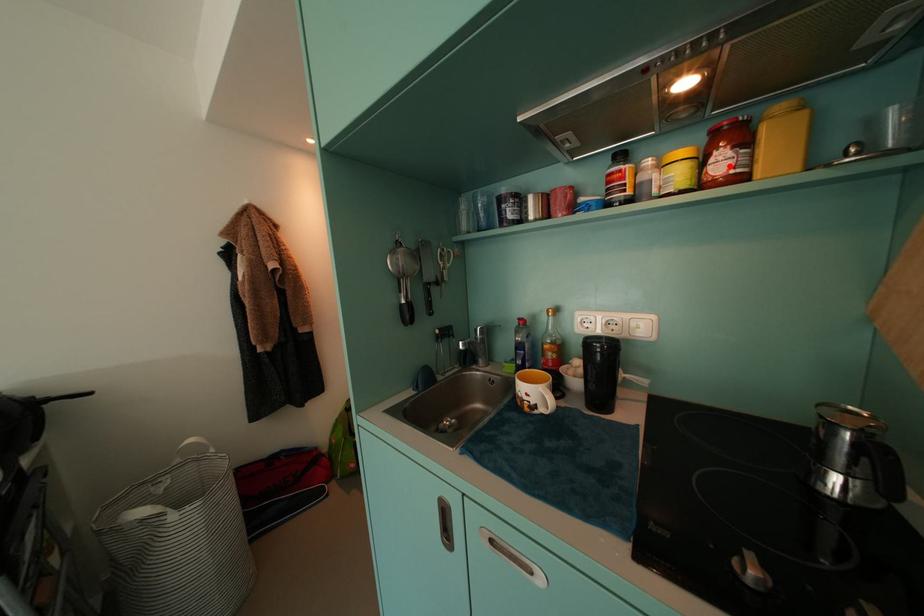
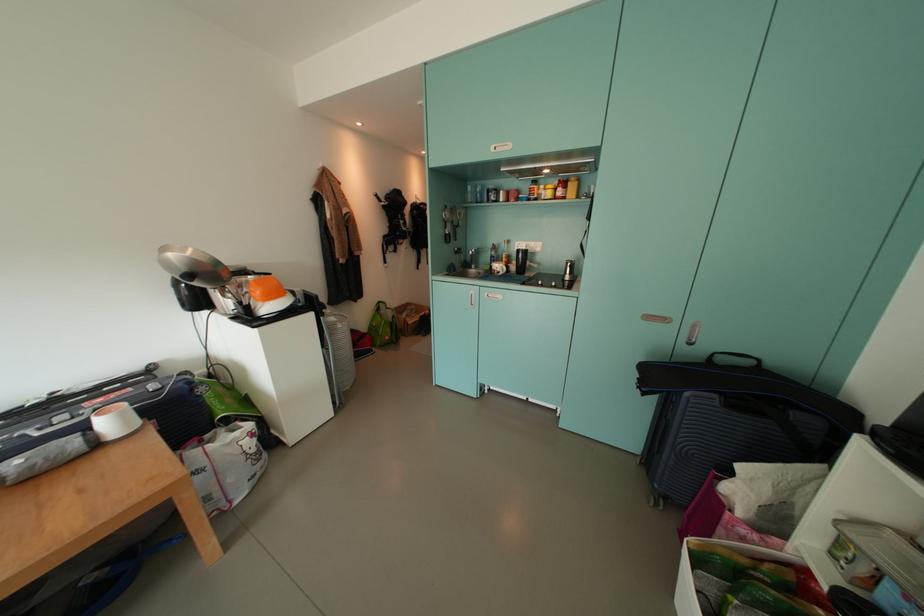
In the second image, find the point that corresponds to the highlighted location in the first image.

(566, 195)